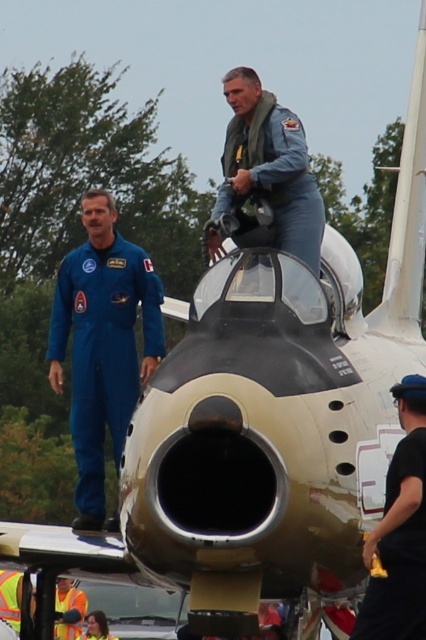
You are a photographer positioned in front of the jet aircraft and want to capture both the blue denim jumpsuit at center and the black matte helmet at upper center in your shot. Which object should you focus on first to ensure both are in sharp focus?

You should focus on the blue denim jumpsuit at center first because it is closer to you than the black matte helmet at upper center, ensuring both will be in focus when focused on the closer object.

You are an attendee at an airshow and you see the black matte helmet at upper center and the high visibility vest at lower left. Which object is closer to the ground?

The high visibility vest at lower left is closer to the ground since it is positioned lower than the black matte helmet at upper center.